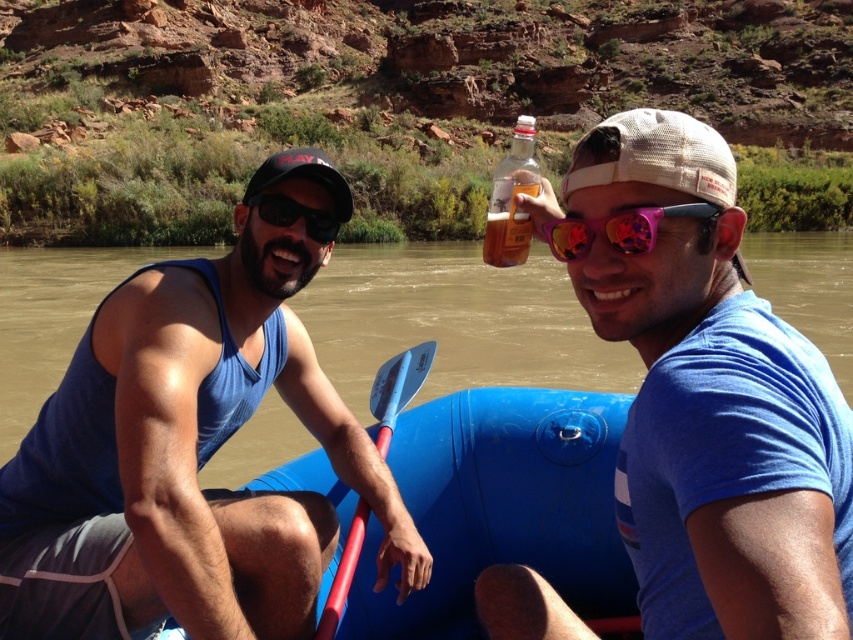
Is matte blue shirt at center behind brown rubber raft at center?

No.

Is matte blue shirt at center to the right of brown rubber raft at center from the viewer's perspective?

No, matte blue shirt at center is not to the right of brown rubber raft at center.

Is point (821, 621) positioned after point (20, 406)?

No, it is not.

The height and width of the screenshot is (640, 853). I want to click on matte blue shirt at center, so click(x=706, y=392).

The image size is (853, 640). I want to click on blue plastic paddle at center, so click(397, 388).

You are a GUI agent. You are given a task and a screenshot of the screen. Output one action in this format:
    pyautogui.click(x=<x>, y=<y>)
    Task: Click on the blue plastic paddle at center
    
    Given the screenshot: What is the action you would take?
    pos(397,388)

Is blue fabric tank top at left further to camera compared to matte black sunglasses at left?

No, it is not.

Does blue fabric tank top at left have a lesser width compared to matte black sunglasses at left?

No.

This screenshot has width=853, height=640. Identify the location of blue fabric tank top at left. (190, 451).

I want to click on blue fabric tank top at left, so click(190, 451).